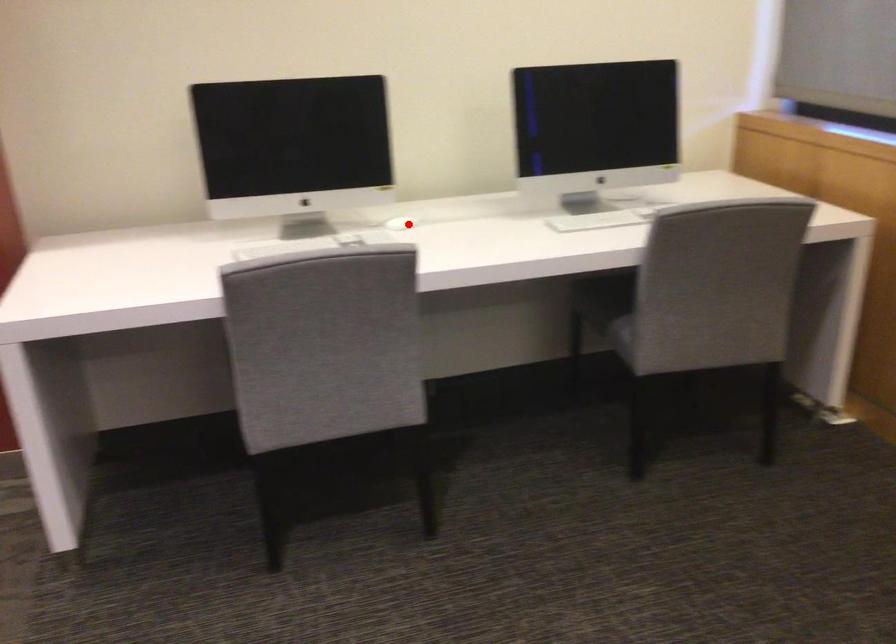
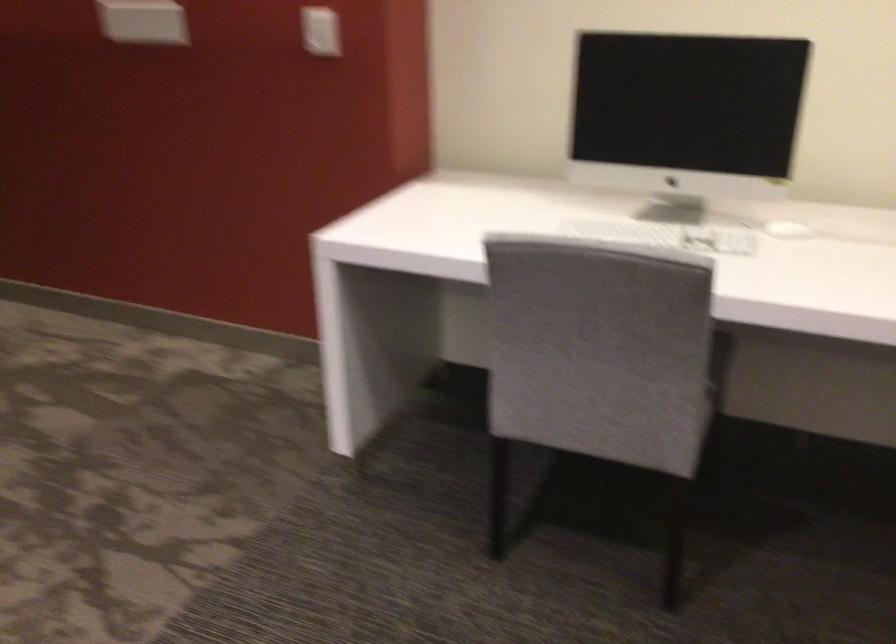
Locate, in the second image, the point that corresponds to the highlighted location in the first image.

(786, 230)